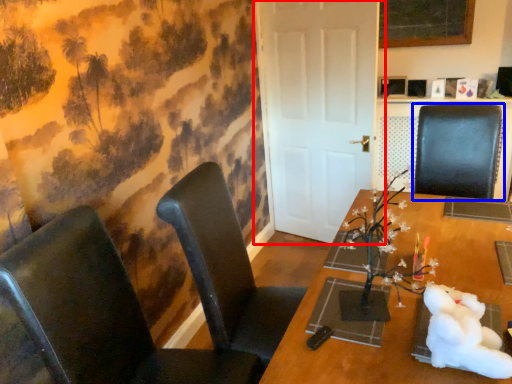
Question: Which object appears closest to the camera in this image, door (highlighted by a red box) or chair (highlighted by a blue box)?

Choices:
 (A) door
 (B) chair

Answer: (B)